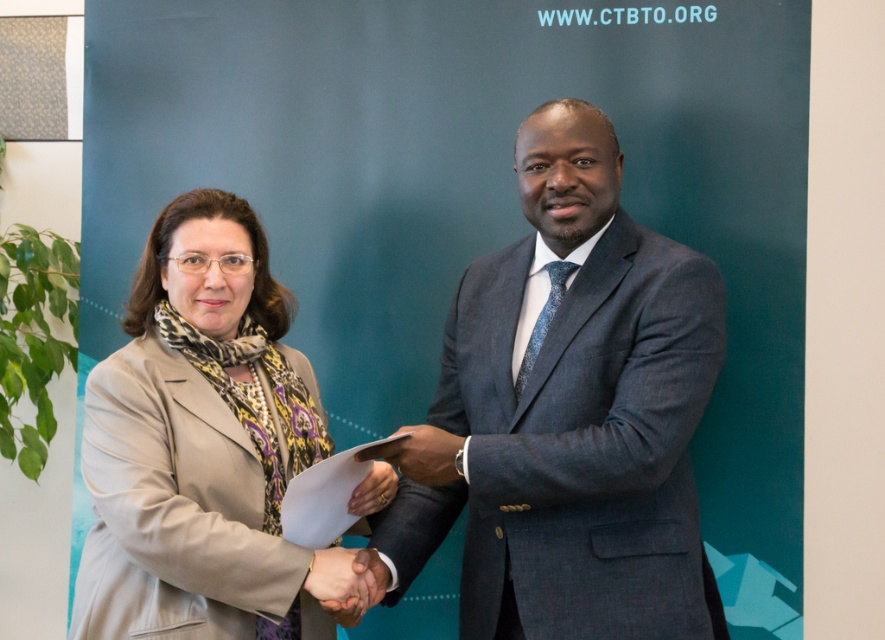
Does dark gray suit at center have a larger size compared to smooth skin handshake at center?

Yes.

Is dark gray suit at center below smooth skin handshake at center?

Incorrect, dark gray suit at center is not positioned below smooth skin handshake at center.

What do you see at coordinates (572, 412) in the screenshot? This screenshot has height=640, width=885. I see `dark gray suit at center` at bounding box center [572, 412].

You are a GUI agent. You are given a task and a screenshot of the screen. Output one action in this format:
    pyautogui.click(x=<x>, y=<y>)
    Task: Click on the dark gray suit at center
    This screenshot has height=640, width=885.
    Given the screenshot: What is the action you would take?
    pyautogui.click(x=572, y=412)

Is beige fabric coat at left to the left of matte black hand at center from the viewer's perspective?

Indeed, beige fabric coat at left is positioned on the left side of matte black hand at center.

Does point (96, 500) come behind point (393, 492)?

No, it is in front of (393, 492).

At what (x,y) coordinates should I click in order to perform the action: click on beige fabric coat at left. Please return your answer as a coordinate pair (x, y). The width and height of the screenshot is (885, 640). Looking at the image, I should click on (199, 442).

Who is positioned more to the left, smooth skin handshake at center or matte black paper at center?

From the viewer's perspective, smooth skin handshake at center appears more on the left side.

Can you confirm if smooth skin handshake at center is positioned below matte black paper at center?

Yes.

The image size is (885, 640). What do you see at coordinates (345, 580) in the screenshot?
I see `smooth skin handshake at center` at bounding box center [345, 580].

Find the location of a particular element. smooth skin handshake at center is located at coordinates (345, 580).